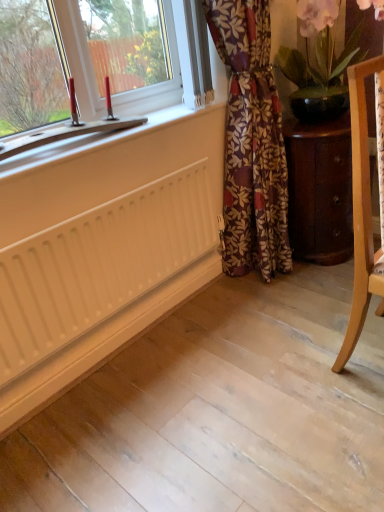
Question: Is white matte radiator at lower left wider than wooden cabinet at lower right?

Choices:
 (A) yes
 (B) no

Answer: (B)

Question: From the image's perspective, is white matte radiator at lower left located beneath wooden cabinet at lower right?

Choices:
 (A) yes
 (B) no

Answer: (A)

Question: From the image's perspective, would you say white matte radiator at lower left is positioned over wooden cabinet at lower right?

Choices:
 (A) yes
 (B) no

Answer: (B)

Question: Is white matte radiator at lower left positioned behind wooden cabinet at lower right?

Choices:
 (A) yes
 (B) no

Answer: (B)

Question: Considering the relative sizes of white matte radiator at lower left and wooden cabinet at lower right in the image provided, is white matte radiator at lower left taller than wooden cabinet at lower right?

Choices:
 (A) no
 (B) yes

Answer: (A)

Question: From a real-world perspective, is white matte radiator at lower left below wooden cabinet at lower right?

Choices:
 (A) no
 (B) yes

Answer: (A)

Question: From a real-world perspective, is matte black pot at upper right below light wood chair at right?

Choices:
 (A) no
 (B) yes

Answer: (A)

Question: From the image's perspective, does matte black pot at upper right appear higher than light wood chair at right?

Choices:
 (A) no
 (B) yes

Answer: (B)

Question: Is matte black pot at upper right further to the viewer compared to light wood chair at right?

Choices:
 (A) yes
 (B) no

Answer: (A)

Question: Is light wood chair at right at the back of matte black pot at upper right?

Choices:
 (A) no
 (B) yes

Answer: (A)

Question: Is matte black pot at upper right outside of light wood chair at right?

Choices:
 (A) yes
 (B) no

Answer: (A)

Question: Is matte black pot at upper right wider than light wood chair at right?

Choices:
 (A) yes
 (B) no

Answer: (A)

Question: Is light wood chair at right facing away from wooden cabinet at lower right?

Choices:
 (A) no
 (B) yes

Answer: (A)